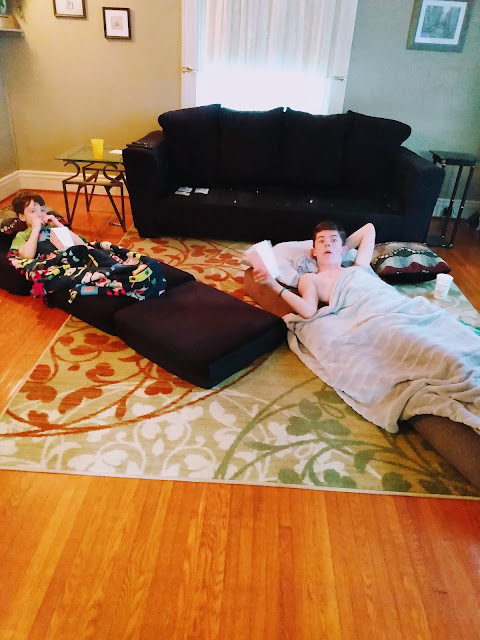
This screenshot has width=480, height=640. In order to click on blankets in this screenshot , I will do `click(59, 276)`, `click(384, 340)`.